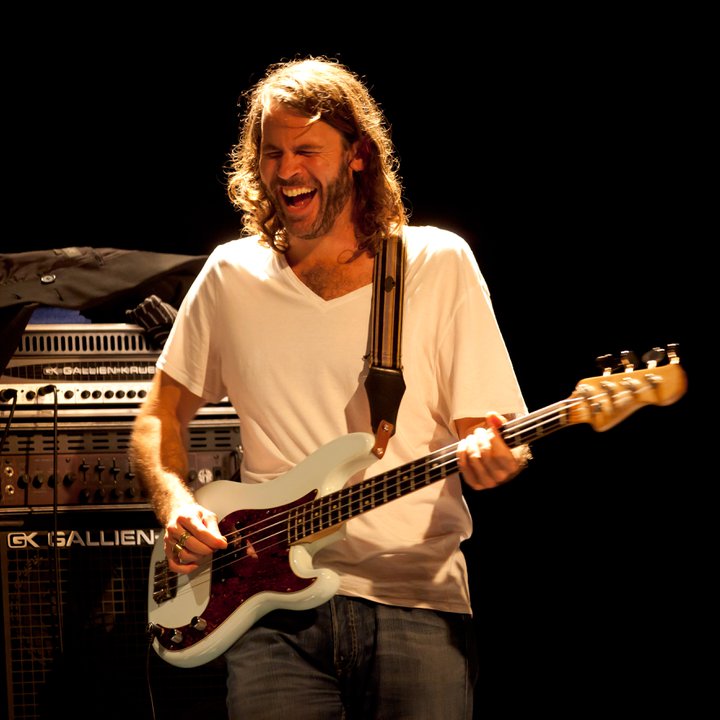
Locate an element on the screen. The width and height of the screenshot is (720, 720). knob is located at coordinates (26, 481).